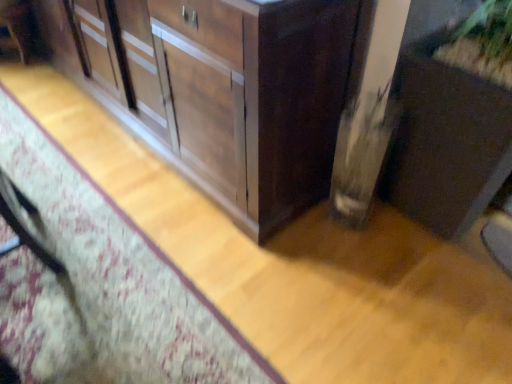
Question: Based on their sizes in the image, would you say wooden cabinet at center, which ranks as the 1th cabinetry in left-to-right order, is bigger or smaller than matte brown cabinet at lower right, the 2th cabinetry viewed from the left?

Choices:
 (A) small
 (B) big

Answer: (B)

Question: Relative to matte brown cabinet at lower right, placed as the 1th cabinetry when sorted from right to left, is wooden cabinet at center, which ranks as the 1th cabinetry in left-to-right order, in front or behind?

Choices:
 (A) behind
 (B) front

Answer: (A)

Question: Would you say wooden cabinet at center, marked as the second cabinetry in a right-to-left arrangement, is inside or outside matte brown cabinet at lower right, the 2th cabinetry viewed from the left?

Choices:
 (A) inside
 (B) outside

Answer: (B)

Question: Is matte brown cabinet at lower right, the 2th cabinetry viewed from the left, spatially inside wooden cabinet at center, marked as the second cabinetry in a right-to-left arrangement, or outside of it?

Choices:
 (A) outside
 (B) inside

Answer: (A)

Question: Based on their sizes in the image, would you say matte brown cabinet at lower right, the 2th cabinetry viewed from the left, is bigger or smaller than wooden cabinet at center, which ranks as the 1th cabinetry in left-to-right order?

Choices:
 (A) small
 (B) big

Answer: (A)

Question: In terms of width, does matte brown cabinet at lower right, placed as the 1th cabinetry when sorted from right to left, look wider or thinner when compared to wooden cabinet at center, marked as the second cabinetry in a right-to-left arrangement?

Choices:
 (A) wide
 (B) thin

Answer: (B)

Question: From the image's perspective, is matte brown cabinet at lower right, placed as the 1th cabinetry when sorted from right to left, positioned above or below wooden cabinet at center, marked as the second cabinetry in a right-to-left arrangement?

Choices:
 (A) above
 (B) below

Answer: (B)